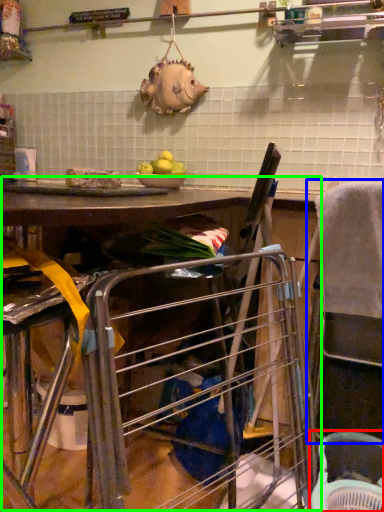
Question: Which object is the farthest from basket (highlighted by a red box)? Choose among these: feeding chair (highlighted by a blue box) or workbench (highlighted by a green box).

Choices:
 (A) feeding chair
 (B) workbench

Answer: (B)